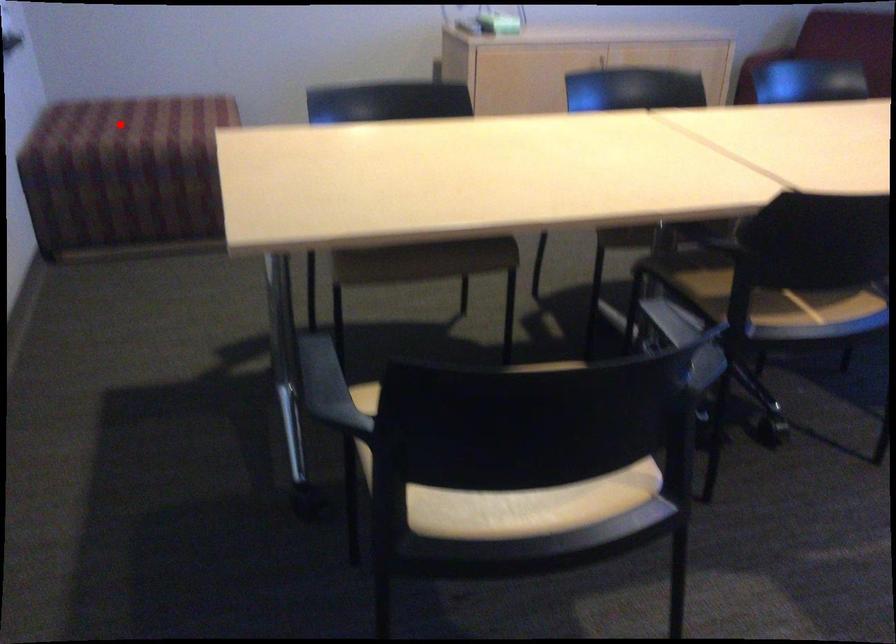
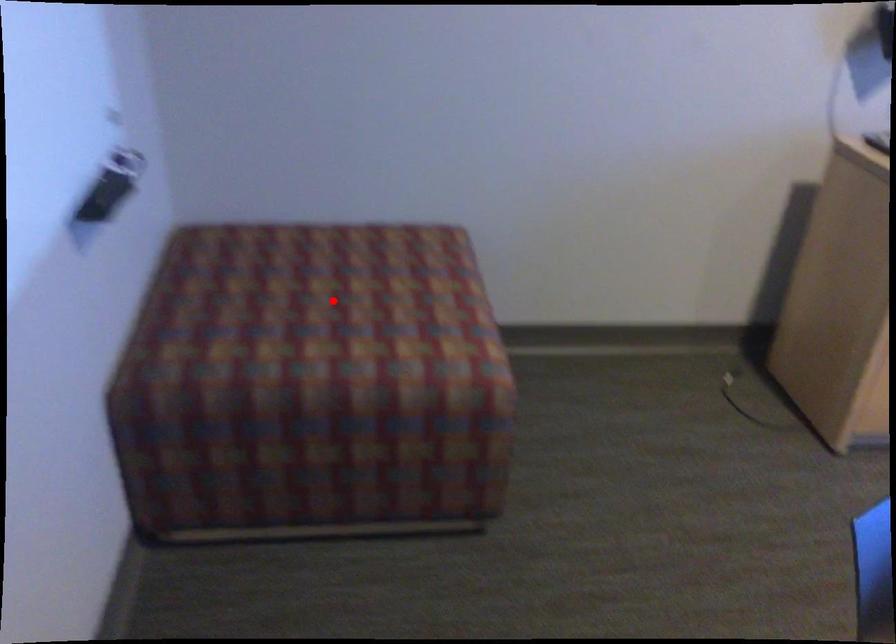
I am providing you with two images of the same scene from different viewpoints. A red point is marked on the first image and another point is marked on the second image. Are the points marked in image1 and image2 representing the same 3D position?

Yes